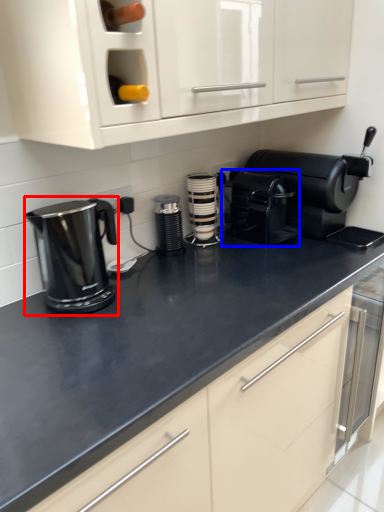
Question: Among these objects, which one is farthest to the camera, home appliance (highlighted by a red box) or coffeepot (highlighted by a blue box)?

Choices:
 (A) home appliance
 (B) coffeepot

Answer: (B)